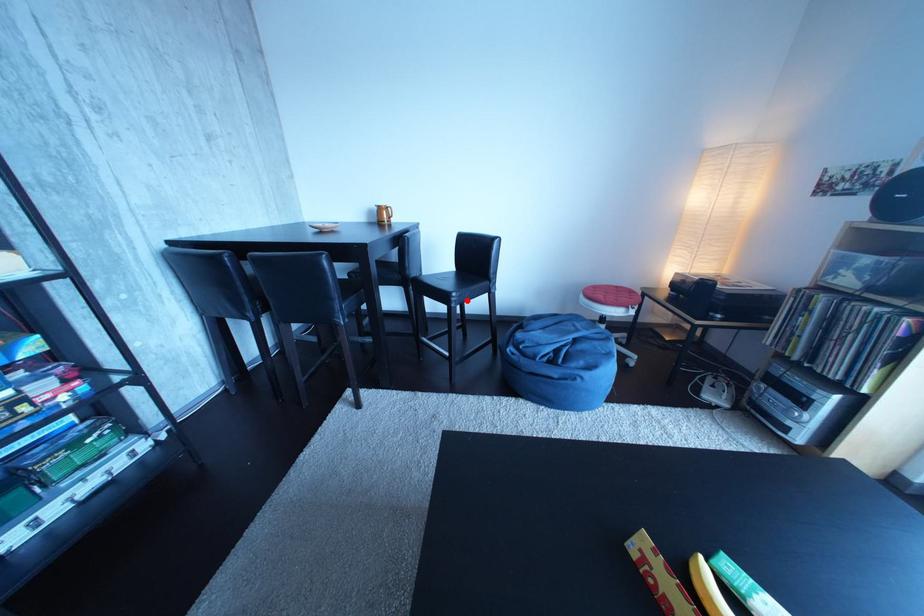
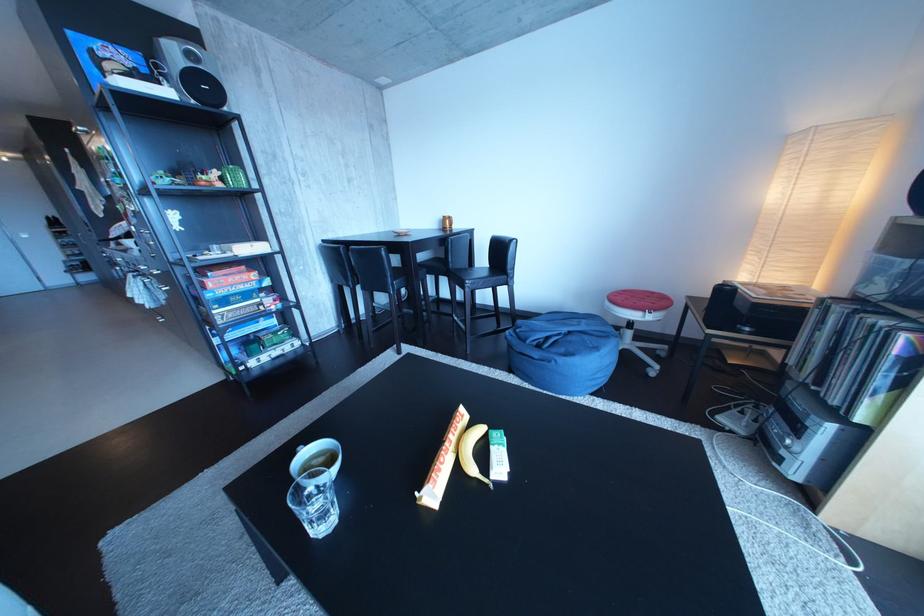
Question: I am providing you with two images of the same scene from different viewpoints. Given a red point in image1, look at the same physical point in image2. Is it:

Choices:
 (A) Closer to the viewpoint
 (B) Farther from the viewpoint

Answer: (A)